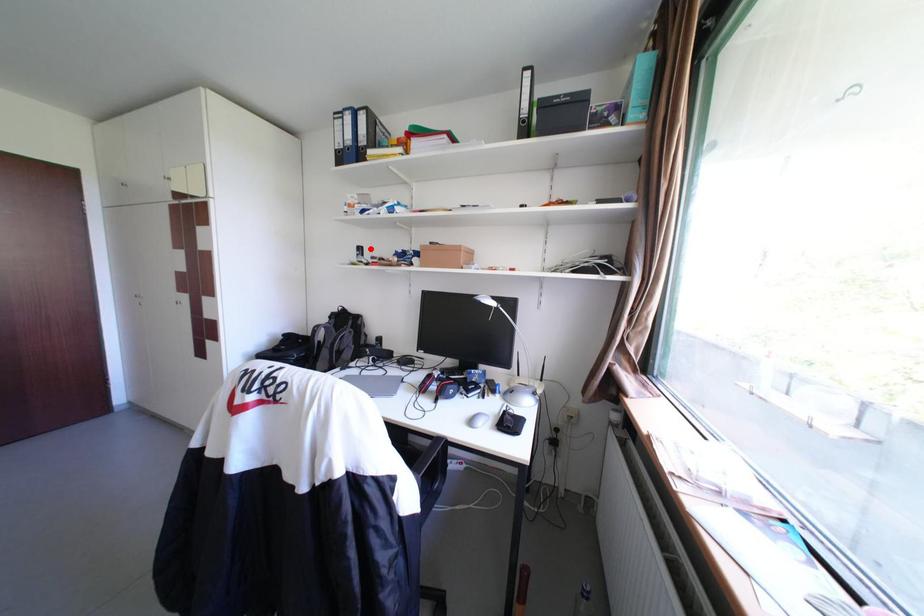
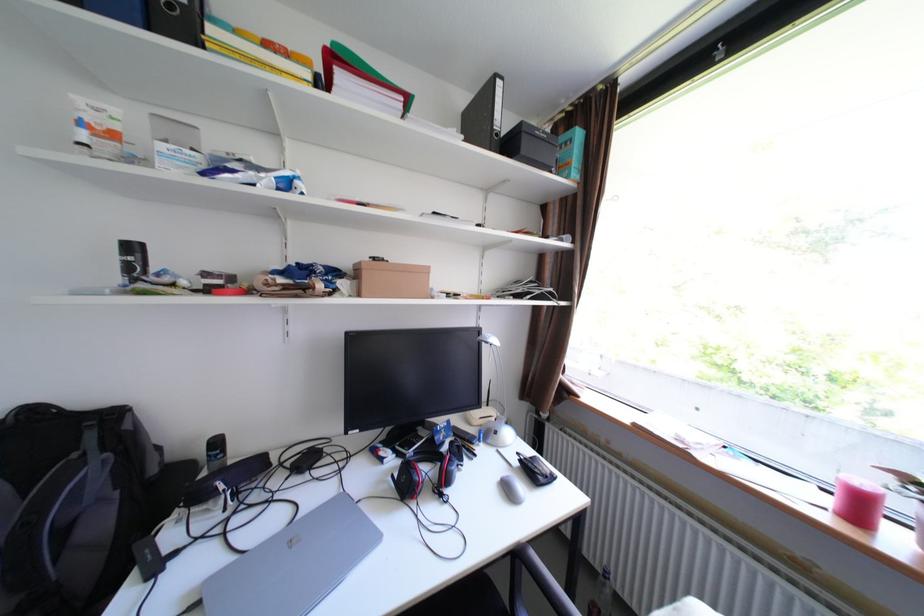
Locate, in the second image, the point that corresponds to the highlighted location in the first image.

(143, 248)